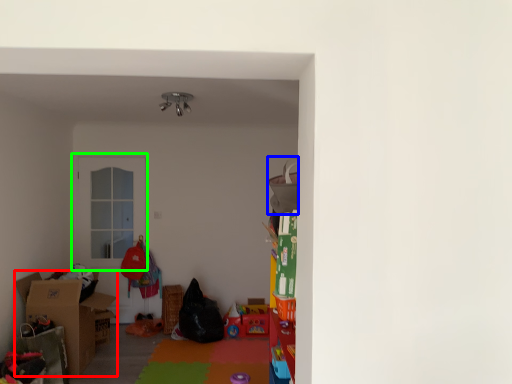
Question: Which object is positioned farthest from box (highlighted by a red box)? Select from bean bag chair (highlighted by a blue box) and door (highlighted by a green box).

Choices:
 (A) bean bag chair
 (B) door

Answer: (A)